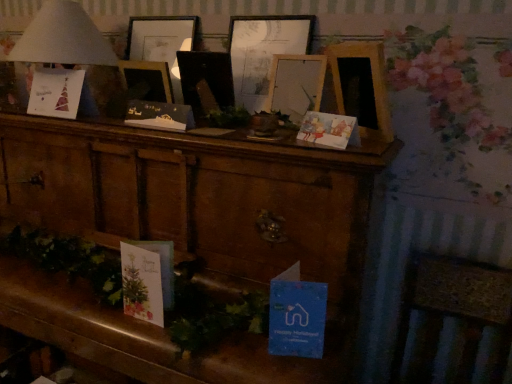
Describe the element at coordinates (159, 116) in the screenshot. The width and height of the screenshot is (512, 384). I see `matte black card at center, arranged as the second christmas card when viewed from the left` at that location.

What is the approximate width of wooden rocking chair at lower right?

wooden rocking chair at lower right is 17.50 inches wide.

This screenshot has height=384, width=512. Describe the element at coordinates (205, 77) in the screenshot. I see `wooden picture frame at center, the 2th picture frame in the left-to-right sequence` at that location.

Measure the distance between point (192, 77) and camera.

Point (192, 77) is 1.24 meters away from camera.

The width and height of the screenshot is (512, 384). What do you see at coordinates (263, 52) in the screenshot?
I see `wooden picture frame at center, which is counted as the 1th picture frame, starting from the right` at bounding box center [263, 52].

How much space does wooden picture frame at center, which ranks as the 3th picture frame in right-to-left order, occupy horizontally?

3.71 inches.

The image size is (512, 384). Identify the location of matte paper card at center right, placed as the third christmas card when sorted from left to right. (329, 130).

What are the coordinates of `matte black card at center, arranged as the second christmas card when viewed from the left` in the screenshot? It's located at (159, 116).

Is the depth of white paper lampshade at upper left greater than that of matte black card at center, arranged as the second christmas card when viewed from the left?

Yes.

From a real-world perspective, is white paper lampshade at upper left beneath matte black card at center, the second christmas card viewed from the right?

No, from a real-world perspective, white paper lampshade at upper left is not beneath matte black card at center, the second christmas card viewed from the right.

Can you confirm if white paper lampshade at upper left is taller than matte black card at center, arranged as the second christmas card when viewed from the front?

Yes.

Can you tell me how much white paper lampshade at upper left and matte black card at center, arranged as the second christmas card when viewed from the left, differ in facing direction?

They differ by 5.48 degrees in their facing directions.

Considering the relative positions of wooden cabinet at center and matte paper card at center right, marked as the 1th christmas card in a front-to-back arrangement, in the image provided, is wooden cabinet at center to the left or to the right of matte paper card at center right, marked as the 1th christmas card in a front-to-back arrangement,?

Clearly, wooden cabinet at center is on the left of matte paper card at center right, marked as the 1th christmas card in a front-to-back arrangement, in the image.

Considering the positions of points (309, 267) and (297, 135), is point (309, 267) closer to camera compared to point (297, 135)?

That is True.

Is wooden cabinet at center spatially inside matte paper card at center right, marked as the 1th christmas card in a front-to-back arrangement, or outside of it?

wooden cabinet at center is not inside matte paper card at center right, marked as the 1th christmas card in a front-to-back arrangement, it's outside.

In terms of height, does wooden cabinet at center look taller or shorter compared to matte paper card at center right, placed as the third christmas card when sorted from left to right?

In the image, wooden cabinet at center appears to be taller than matte paper card at center right, placed as the third christmas card when sorted from left to right.

Looking at this image, how much distance is there between wooden picture frame at center, which is counted as the 2th picture frame, starting from the right, and wooden cabinet at center?

The distance of wooden picture frame at center, which is counted as the 2th picture frame, starting from the right, from wooden cabinet at center is 16.54 inches.

Are wooden picture frame at center, the 2th picture frame in the left-to-right sequence, and wooden cabinet at center far apart?

wooden picture frame at center, the 2th picture frame in the left-to-right sequence, is actually quite close to wooden cabinet at center.

From the image's perspective, which is above, wooden picture frame at center, which is counted as the 2th picture frame, starting from the right, or wooden cabinet at center?

wooden picture frame at center, which is counted as the 2th picture frame, starting from the right, from the image's perspective.

Does white paper lampshade at upper left come behind wooden cabinet at center?

Yes, it is behind wooden cabinet at center.

How many degrees apart are the facing directions of white paper lampshade at upper left and wooden cabinet at center?

They differ by 0.604 degrees in their facing directions.

Considering the sizes of white paper lampshade at upper left and wooden cabinet at center in the image, is white paper lampshade at upper left taller or shorter than wooden cabinet at center?

white paper lampshade at upper left is shorter than wooden cabinet at center.

Which is correct: white paper lampshade at upper left is inside wooden cabinet at center, or outside of it?

white paper lampshade at upper left is not inside wooden cabinet at center, it's outside.

Is matte paper card at center right, the 1th christmas card when ordered from right to left, looking in the opposite direction of wooden rocking chair at lower right?

matte paper card at center right, the 1th christmas card when ordered from right to left, does not have its back to wooden rocking chair at lower right.

From the image's perspective, is matte paper card at center right, placed as the third christmas card when sorted from back to front, positioned above or below wooden rocking chair at lower right?

matte paper card at center right, placed as the third christmas card when sorted from back to front, is situated higher than wooden rocking chair at lower right in the image.

Considering the points (349, 133) and (500, 331), which point is in front, point (349, 133) or point (500, 331)?

The point (349, 133) is more forward.

Is the position of matte paper card at upper left, which is the first christmas card in left-to-right order, less distant than that of matte black card at center, the second christmas card viewed from the right?

No, it is not.

Which point is more forward, (55, 106) or (130, 117)?

The point (130, 117) is more forward.

In order to click on christmas card above the matte black card at center, arranged as the second christmas card when viewed from the left (from the image's perspective) in this screenshot , I will do `click(56, 92)`.

Does matte paper card at upper left, arranged as the 3th christmas card when viewed from the front, turn towards matte black card at center, arranged as the second christmas card when viewed from the front?

No, matte paper card at upper left, arranged as the 3th christmas card when viewed from the front, does not turn towards matte black card at center, arranged as the second christmas card when viewed from the front.

From their relative heights in the image, would you say wooden cabinet at center is taller or shorter than wooden picture frame at center, which ranks as the 3th picture frame in right-to-left order?

wooden cabinet at center is taller than wooden picture frame at center, which ranks as the 3th picture frame in right-to-left order.

Which is more to the right, wooden cabinet at center or wooden picture frame at center, placed as the 1th picture frame when sorted from left to right?

From the viewer's perspective, wooden picture frame at center, placed as the 1th picture frame when sorted from left to right, appears more on the right side.

Where is `table lamp above the matte black card at center, arranged as the second christmas card when viewed from the front (from the image's perspective)`? table lamp above the matte black card at center, arranged as the second christmas card when viewed from the front (from the image's perspective) is located at coordinates (x=63, y=38).

Image resolution: width=512 pixels, height=384 pixels. In the image, there is a matte paper card at center right, the 1th christmas card when ordered from right to left. What are the coordinates of `furniture below it (from the image's perspective)` in the screenshot? It's located at (185, 237).

Based on their spatial positions, is white paper lampshade at upper left or wooden picture frame at center, which is counted as the 2th picture frame, starting from the right, further from matte black card at center, the second christmas card viewed from the right?

Based on the image, white paper lampshade at upper left appears to be further to matte black card at center, the second christmas card viewed from the right.

Which object lies nearer to the anchor point wooden cabinet at center, wooden picture frame at center, which ranks as the 3th picture frame in right-to-left order, or white paper lampshade at upper left?

white paper lampshade at upper left lies closer to wooden cabinet at center than the other object.

From the image, which object appears to be nearer to matte paper card at center right, marked as the 1th christmas card in a front-to-back arrangement, wooden picture frame at center, which is counted as the 1th picture frame, starting from the right, or wooden rocking chair at lower right?

wooden picture frame at center, which is counted as the 1th picture frame, starting from the right, lies closer to matte paper card at center right, marked as the 1th christmas card in a front-to-back arrangement, than the other object.

Estimate the real-world distances between objects in this image. Which object is further from wooden picture frame at center, which is counted as the 1th picture frame, starting from the right, matte paper card at center right, marked as the 1th christmas card in a front-to-back arrangement, or white paper lampshade at upper left?

Among the two, white paper lampshade at upper left is located further to wooden picture frame at center, which is counted as the 1th picture frame, starting from the right.

Estimate the real-world distances between objects in this image. Which object is closer to matte black card at center, arranged as the second christmas card when viewed from the front, matte paper card at center right, marked as the 1th christmas card in a front-to-back arrangement, or wooden picture frame at center, which is counted as the 3th picture frame, starting from the left?

wooden picture frame at center, which is counted as the 3th picture frame, starting from the left, lies closer to matte black card at center, arranged as the second christmas card when viewed from the front, than the other object.

From the image, which object appears to be farther from matte paper card at center right, the 1th christmas card when ordered from right to left, wooden picture frame at center, the 2th picture frame in the left-to-right sequence, or matte black card at center, arranged as the second christmas card when viewed from the front?

Among the two, matte black card at center, arranged as the second christmas card when viewed from the front, is located further to matte paper card at center right, the 1th christmas card when ordered from right to left.

Which object lies further to the anchor point wooden picture frame at center, which is counted as the 1th picture frame, starting from the right, wooden picture frame at center, which ranks as the 3th picture frame in right-to-left order, or wooden cabinet at center?

Among the two, wooden cabinet at center is located further to wooden picture frame at center, which is counted as the 1th picture frame, starting from the right.

Considering their positions, is wooden picture frame at center, which is counted as the 2th picture frame, starting from the right, positioned further to wooden rocking chair at lower right than matte black card at center, which appears as the second christmas card when viewed from the back?

matte black card at center, which appears as the second christmas card when viewed from the back, lies further to wooden rocking chair at lower right than the other object.

This screenshot has height=384, width=512. What are the coordinates of `table lamp that lies between wooden picture frame at center, which ranks as the 3th picture frame in right-to-left order, and wooden cabinet at center from top to bottom` in the screenshot? It's located at [x=63, y=38].

At what (x,y) coordinates should I click in order to perform the action: click on picture frame between matte paper card at upper left, which is the 1th christmas card from back to front, and wooden cabinet at center from top to bottom. Please return your answer as a coordinate pair (x, y). Image resolution: width=512 pixels, height=384 pixels. Looking at the image, I should click on (205, 77).

At what (x,y) coordinates should I click in order to perform the action: click on christmas card situated between wooden picture frame at center, placed as the 1th picture frame when sorted from left to right, and matte paper card at center right, placed as the third christmas card when sorted from left to right, from left to right. Please return your answer as a coordinate pair (x, y). Looking at the image, I should click on (159, 116).

Locate an element on the screen. The height and width of the screenshot is (384, 512). picture frame between matte paper card at upper left, acting as the third christmas card starting from the right, and wooden picture frame at center, which is counted as the 2th picture frame, starting from the right, in the horizontal direction is located at coordinates (160, 39).